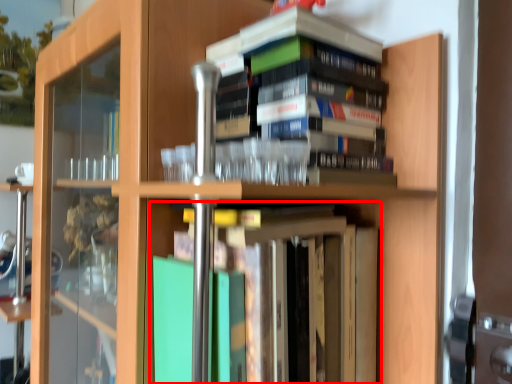
Question: From the image's perspective, what is the correct spatial relationship of book (annotated by the red box) in relation to book?

Choices:
 (A) below
 (B) above

Answer: (A)